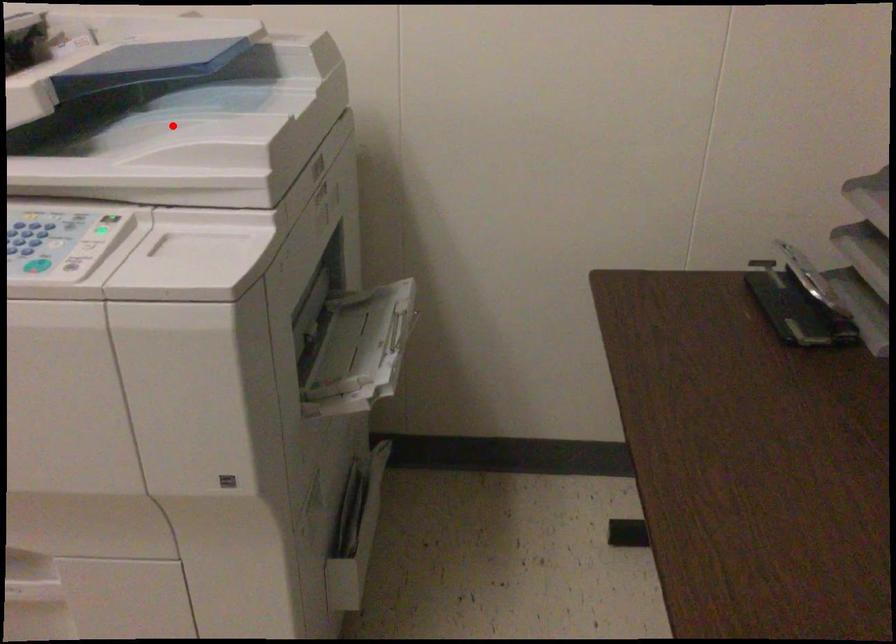
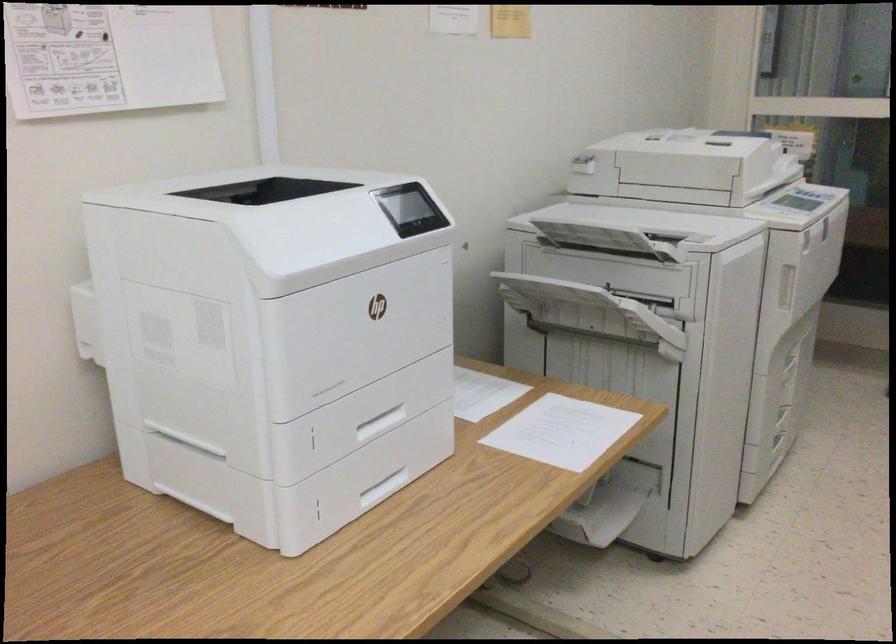
Question: I am providing you with two images of the same scene from different viewpoints. A red point is marked on the first image. Can you still see the location of the red point in image 2?

Choices:
 (A) Yes
 (B) No

Answer: (B)